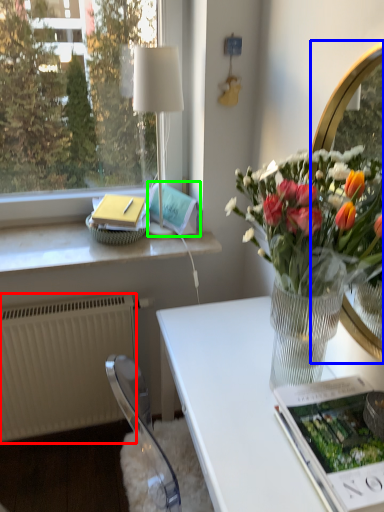
Question: Estimate the real-world distances between objects in this image. Which object is closer to radiator (highlighted by a red box), mirror (highlighted by a blue box) or magazine (highlighted by a green box)?

Choices:
 (A) mirror
 (B) magazine

Answer: (B)